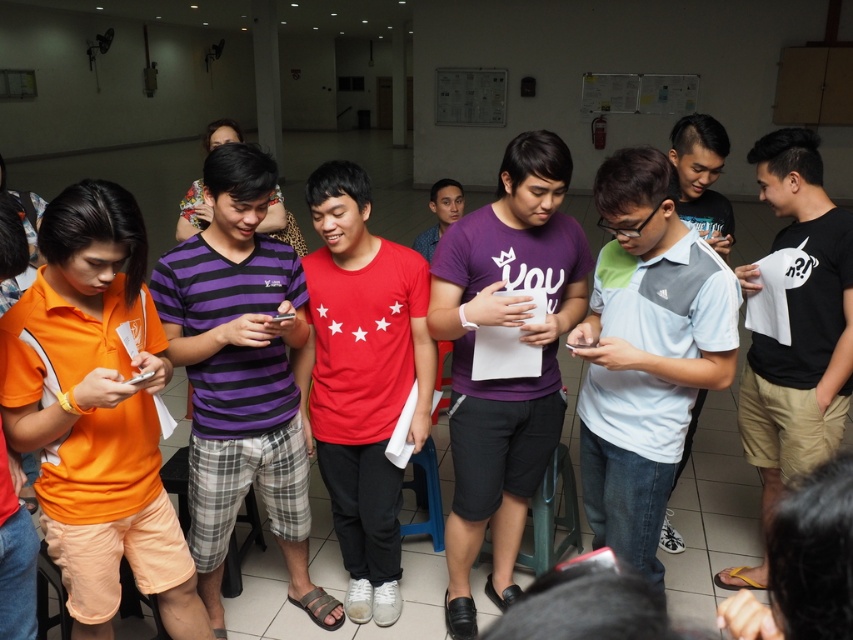
Question: Does light blue and gray adidas polo shirt at center appear over red matte t-shirt at center?

Choices:
 (A) no
 (B) yes

Answer: (B)

Question: Can you confirm if purple striped shirt at center is smaller than light blue and gray adidas polo shirt at center?

Choices:
 (A) no
 (B) yes

Answer: (B)

Question: Can you confirm if light blue and gray adidas polo shirt at center is positioned to the right of purple matte shirt at center?

Choices:
 (A) no
 (B) yes

Answer: (B)

Question: Which is nearer to the purple matte shirt at center?

Choices:
 (A) red matte t-shirt at center
 (B) light blue and gray adidas polo shirt at center
 (C) purple striped shirt at center

Answer: (B)

Question: Which point appears farthest from the camera in this image?

Choices:
 (A) (672, 298)
 (B) (466, 216)

Answer: (B)

Question: Estimate the real-world distances between objects in this image. Which object is farther from the red matte t-shirt at center?

Choices:
 (A) light blue and gray adidas polo shirt at center
 (B) purple matte shirt at center

Answer: (A)